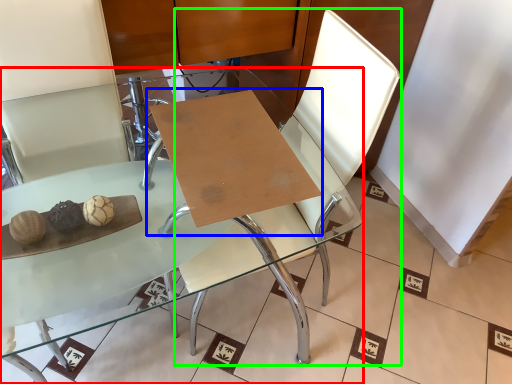
Question: Considering the real-world distances, which object is closest to table (highlighted by a red box)? table (highlighted by a blue box) or swivel chair (highlighted by a green box).

Choices:
 (A) table
 (B) swivel chair

Answer: (B)